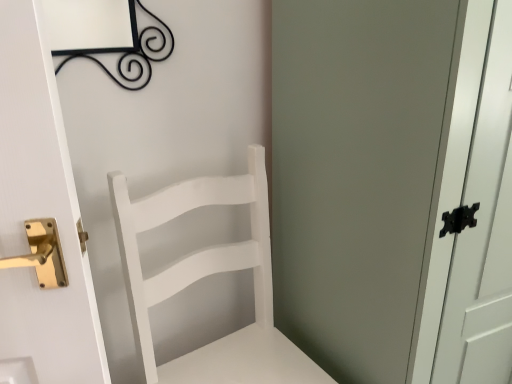
Question: Considering the relative positions of white matte chair at center and white matte cabinet at right in the image provided, is white matte chair at center to the left or to the right of white matte cabinet at right?

Choices:
 (A) left
 (B) right

Answer: (A)

Question: In terms of height, does white matte chair at center look taller or shorter compared to white matte cabinet at right?

Choices:
 (A) short
 (B) tall

Answer: (A)

Question: Is white matte chair at center in front of or behind white matte cabinet at right in the image?

Choices:
 (A) front
 (B) behind

Answer: (B)

Question: From the image's perspective, is white matte cabinet at right above or below white matte chair at center?

Choices:
 (A) above
 (B) below

Answer: (A)

Question: From their relative heights in the image, would you say white matte cabinet at right is taller or shorter than white matte chair at center?

Choices:
 (A) short
 (B) tall

Answer: (B)

Question: Considering the positions of white matte cabinet at right and white matte chair at center in the image, is white matte cabinet at right wider or thinner than white matte chair at center?

Choices:
 (A) wide
 (B) thin

Answer: (A)

Question: Is white matte cabinet at right inside or outside of white matte chair at center?

Choices:
 (A) inside
 (B) outside

Answer: (B)